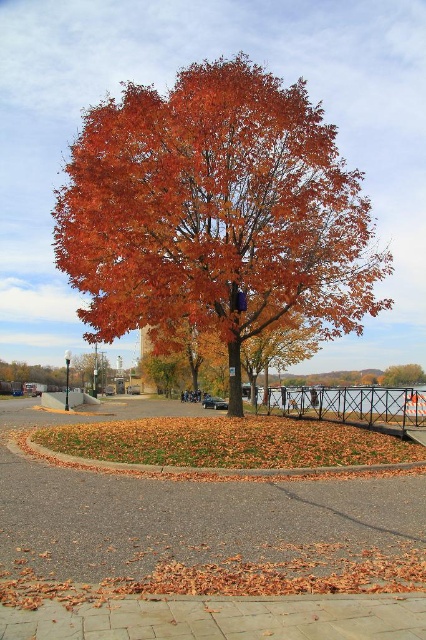
Is the position of shiny orange leaves at center more distant than that of orange matte tree at center?

That is False.

Is shiny orange leaves at center above orange matte tree at center?

Indeed, shiny orange leaves at center is positioned over orange matte tree at center.

In order to click on shiny orange leaves at center in this screenshot , I will do `click(215, 212)`.

Who is more distant from viewer, (154,321) or (20,428)?

The point (20,428) is more distant.

Can you confirm if shiny orange leaves at center is shorter than brown brick pavement at center?

No, shiny orange leaves at center is not shorter than brown brick pavement at center.

At what (x,y) coordinates should I click in order to perform the action: click on shiny orange leaves at center. Please return your answer as a coordinate pair (x, y). Image resolution: width=426 pixels, height=640 pixels. Looking at the image, I should click on pyautogui.click(x=215, y=212).

Which of these two, brown brick pavement at center or orange matte tree at center, stands shorter?

With less height is orange matte tree at center.

Is brown brick pavement at center taller than orange matte tree at center?

Yes, brown brick pavement at center is taller than orange matte tree at center.

Where is `brown brick pavement at center`? Image resolution: width=426 pixels, height=640 pixels. brown brick pavement at center is located at coordinates (184, 512).

Locate an element on the screen. brown brick pavement at center is located at coordinates 184,512.